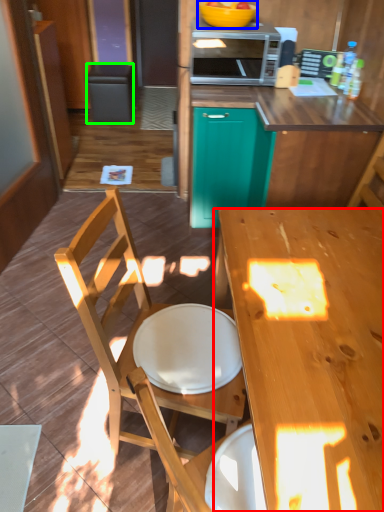
Question: Which object is positioned closest to desk (highlighted by a red box)? Select from bowl (highlighted by a blue box) and trash bin/can (highlighted by a green box).

Choices:
 (A) bowl
 (B) trash bin/can

Answer: (A)